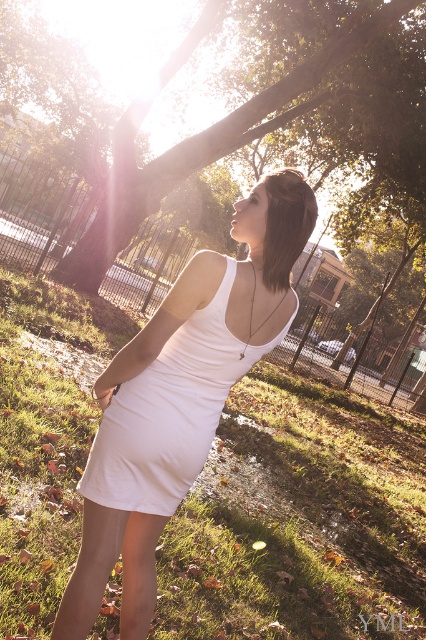
You are a photographer planning to take a portrait of the woman in the scene. You want to ensure the white fabric dress at center is visible against the green leafy tree at upper center. Based on their positions, which object should you focus on to achieve this contrast?

The white fabric dress at center is positioned on the right side of the green leafy tree at upper center. To achieve contrast between the white dress and the green tree, focus on the white fabric dress at center as it is placed next to the green background, creating a clear visual distinction.

You are an artist preparing to sketch this scene. You want to ensure the proportions between the white fabric dress at center and the green leafy tree at upper center are accurate. Which object should you draw first to maintain proper scale, and why?

You should draw the green leafy tree at upper center first because it is larger than the white fabric dress at center. By starting with the larger object, you can better gauge the relative size of the smaller dress in relation to it.

You are a fashion designer observing two dresses in the image. The first is the white matte dress at center, and the second is the white fabric dress at center. Which dress is bigger in size?

The white matte dress at center has a larger size compared to the white fabric dress at center, so the white matte dress at center is bigger.